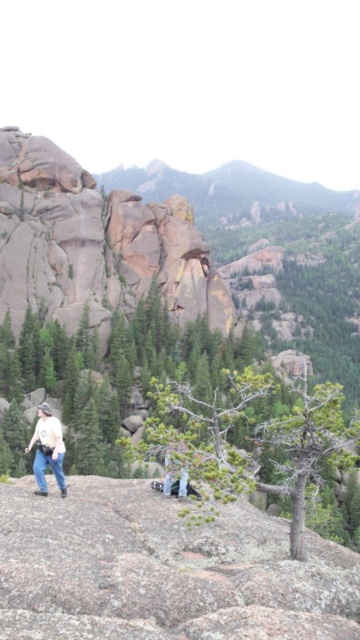
Question: Is green matte tree at center wider than light beige shirt at lower left?

Choices:
 (A) no
 (B) yes

Answer: (B)

Question: Is green matte tree at center to the right of light beige shirt at lower left from the viewer's perspective?

Choices:
 (A) no
 (B) yes

Answer: (B)

Question: Which of the following is the farthest from the observer?

Choices:
 (A) green matte tree at center
 (B) light beige shirt at lower left

Answer: (B)

Question: Which object appears closest to the camera in this image?

Choices:
 (A) light beige shirt at lower left
 (B) green matte tree at center

Answer: (B)

Question: Can you confirm if green matte tree at center is thinner than light beige shirt at lower left?

Choices:
 (A) no
 (B) yes

Answer: (A)

Question: Which object appears closest to the camera in this image?

Choices:
 (A) light beige shirt at lower left
 (B) green matte tree at center

Answer: (B)